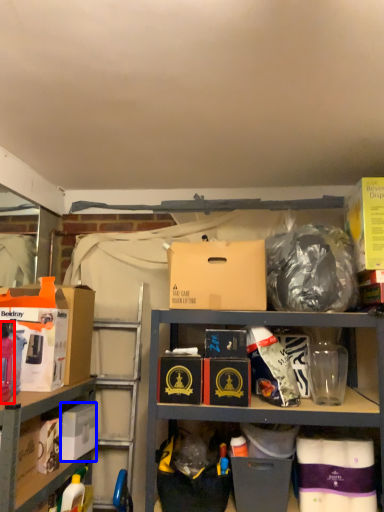
Question: Which of the following is the closest to the observer, bottle (highlighted by a red box) or box (highlighted by a blue box)?

Choices:
 (A) bottle
 (B) box

Answer: (A)